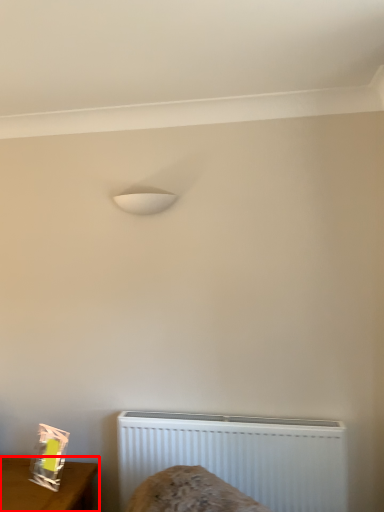
Question: From the image's perspective, where is furniture (annotated by the red box) located in relation to radiator in the image?

Choices:
 (A) above
 (B) below

Answer: (B)